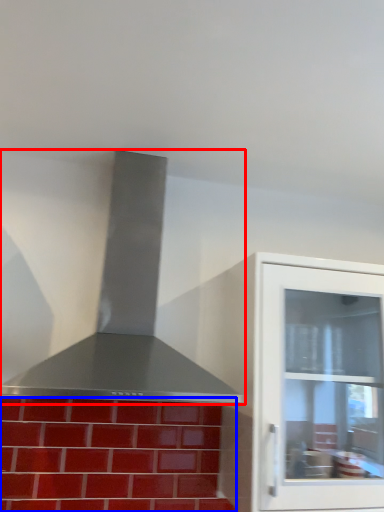
Question: Which object is closer to the camera taking this photo, vent (highlighted by a red box) or brickwork (highlighted by a blue box)?

Choices:
 (A) vent
 (B) brickwork

Answer: (A)